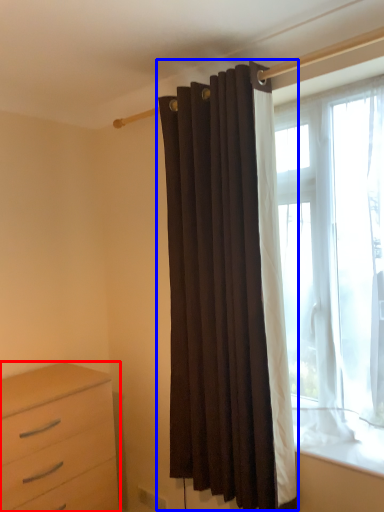
Question: Among these objects, which one is nearest to the camera, chest of drawers (highlighted by a red box) or curtain (highlighted by a blue box)?

Choices:
 (A) chest of drawers
 (B) curtain

Answer: (B)